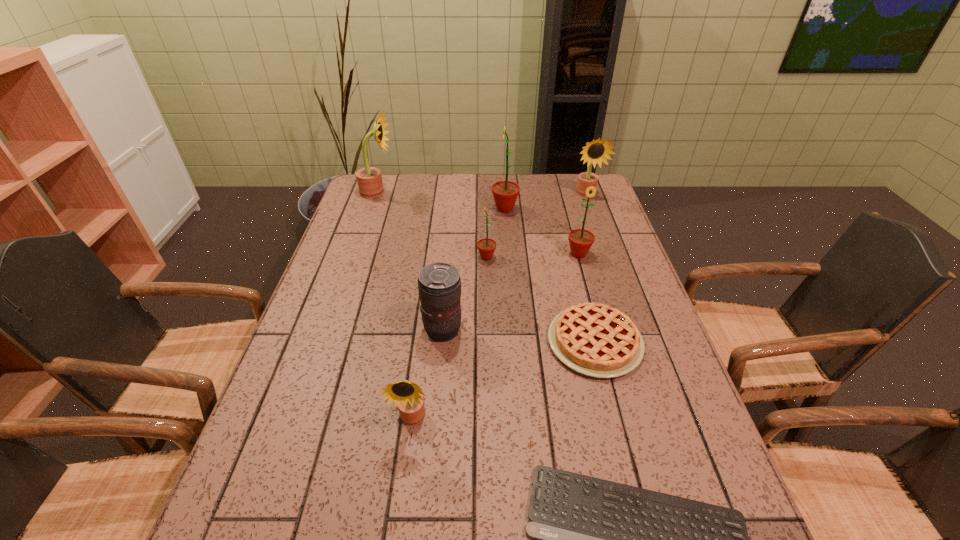
Locate an element on the screen. the eighth tallest object is located at coordinates (597, 340).

Where is `vacant space located 0.060m on the face of the leftmost sunflower`? vacant space located 0.060m on the face of the leftmost sunflower is located at coordinates (x=411, y=192).

This screenshot has height=540, width=960. I want to click on blank space located 0.060m on the face of the biggest green sunflower, so click(473, 209).

You are a GUI agent. You are given a task and a screenshot of the screen. Output one action in this format:
    pyautogui.click(x=<x>, y=<y>)
    Task: Click on the free space located 0.050m on the face of the biggest green sunflower
    The height and width of the screenshot is (540, 960).
    Given the screenshot: What is the action you would take?
    click(476, 209)

I want to click on vacant space located on the face of the biggest green sunflower, so click(382, 209).

Identify the location of free point located on the face of the rightmost green sunflower. The height and width of the screenshot is (540, 960). (608, 361).

The width and height of the screenshot is (960, 540). In order to click on free space located 0.380m on the face of the second smallest yellow sunflower in this screenshot , I will do `click(613, 271)`.

This screenshot has height=540, width=960. Identify the location of free spot located on the side of the telephoto lens where the control switches are located. (487, 330).

This screenshot has height=540, width=960. Identify the location of vacant space located on the face of the smallest green sunflower. (397, 257).

In order to click on free space located 0.220m on the face of the smallest green sunflower in this screenshot , I will do `click(404, 257)`.